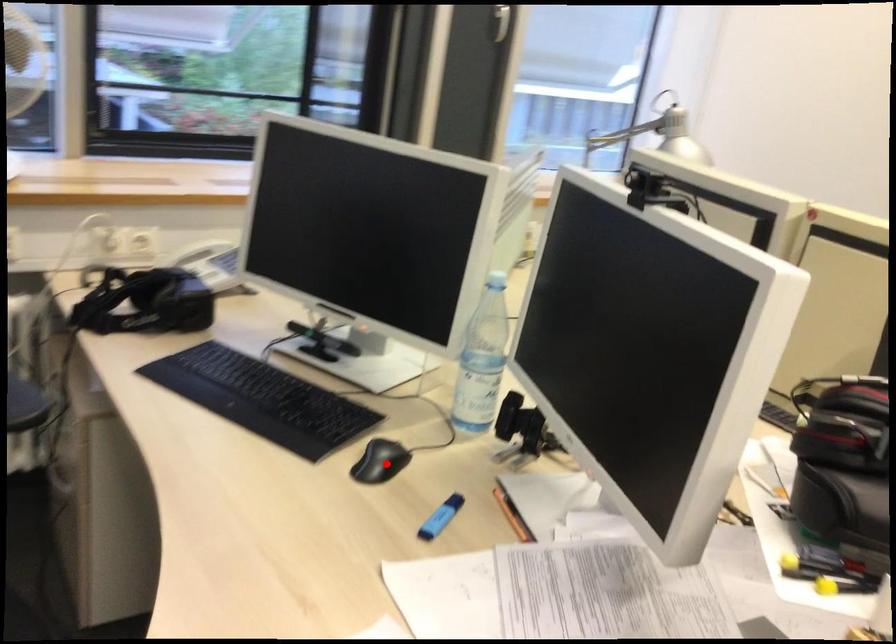
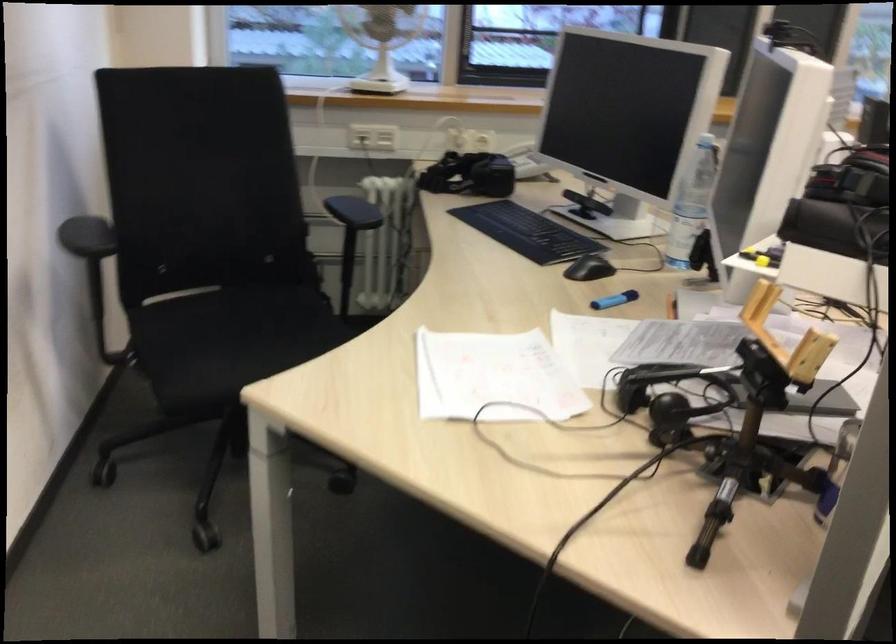
Where in the second image is the point corresponding to the highlighted location from the first image?

(589, 268)